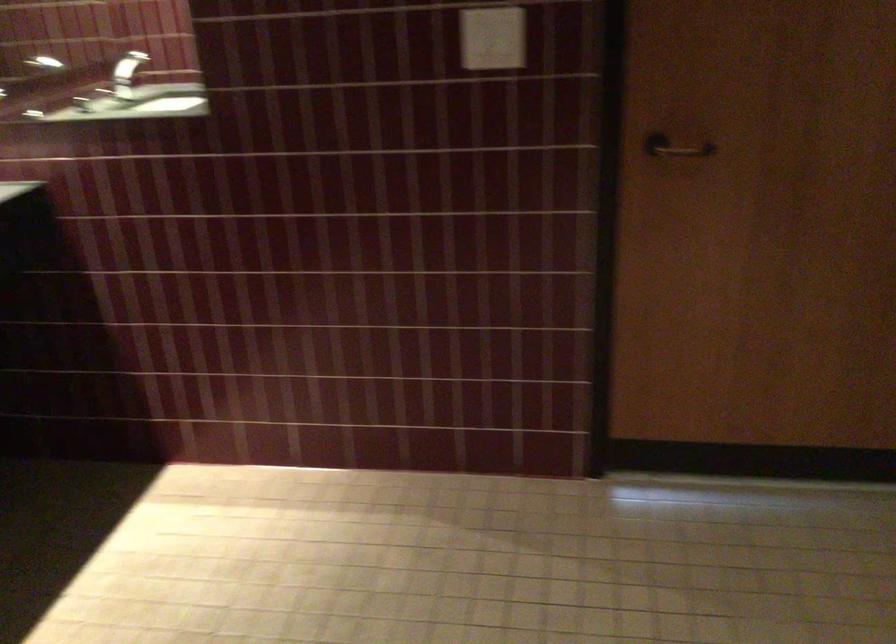
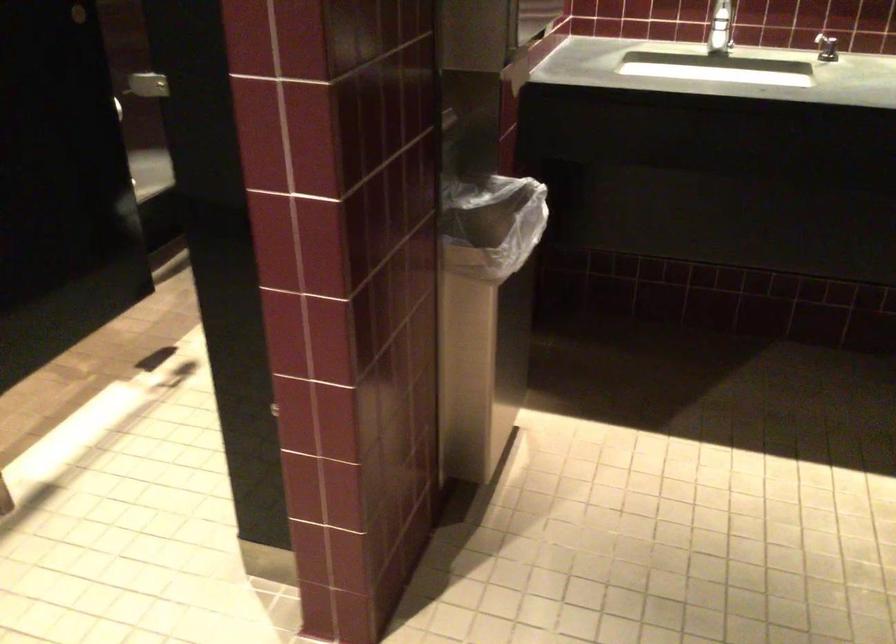
Based on the continuous images, in which direction is the camera rotating?

The camera's rotation is toward left-down.